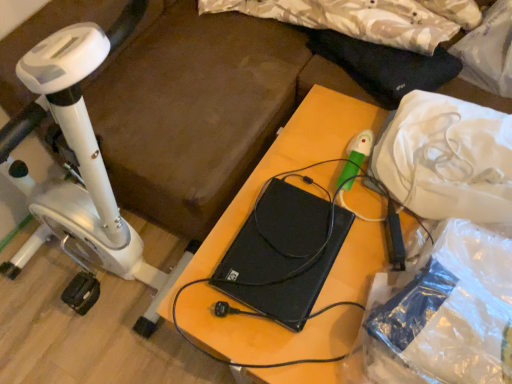
Locate an element on the screen. Image resolution: width=512 pixels, height=384 pixels. free point above black matte laptop at center (from a real-world perspective) is located at coordinates (340, 228).